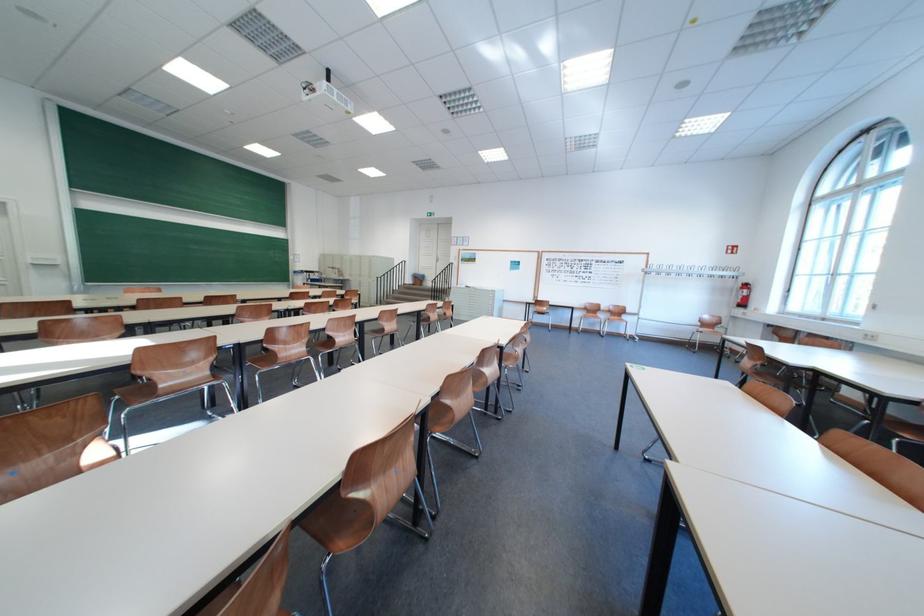
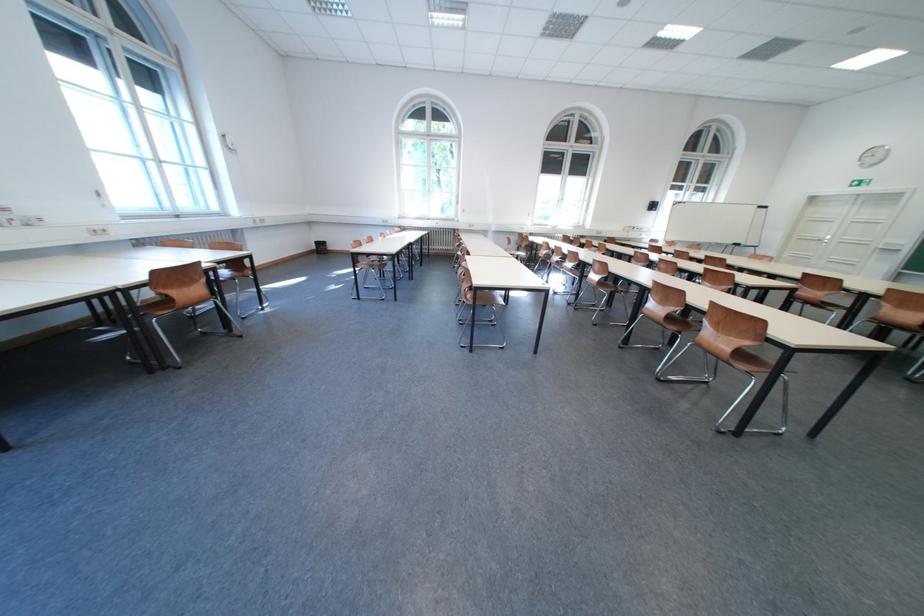
Where in the second image is the point corresponding to point 301,297 from the first image?

(813, 278)